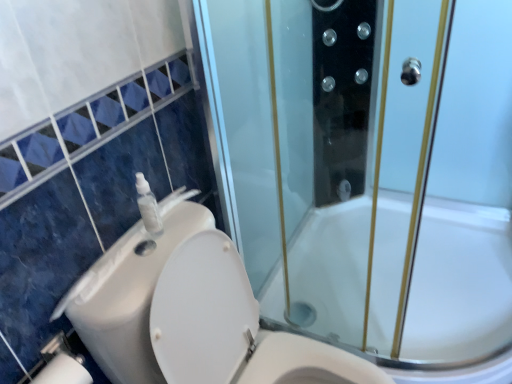
The height and width of the screenshot is (384, 512). Find the location of `transparent glass shower door at center`. transparent glass shower door at center is located at coordinates (371, 173).

In order to face transparent glass shower door at center, should I rotate leftwards or rightwards?

You should look right and rotate roughly 19.530 degrees.

What is the approximate height of white plastic toilet at lower left?

It is 33.15 inches.

This screenshot has width=512, height=384. I want to click on transparent plastic soap dispenser at upper left, so 148,206.

In order to click on transparent glass shower door at center in this screenshot , I will do `click(371, 173)`.

Consider the image. Can you confirm if transparent plastic soap dispenser at upper left is thinner than transparent glass shower door at center?

Yes, transparent plastic soap dispenser at upper left is thinner than transparent glass shower door at center.

From the image's perspective, is transparent plastic soap dispenser at upper left above transparent glass shower door at center?

No, from the image's perspective, transparent plastic soap dispenser at upper left is not above transparent glass shower door at center.

From a real-world perspective, is transparent plastic soap dispenser at upper left physically located above or below transparent glass shower door at center?

Clearly, from a real-world perspective, transparent plastic soap dispenser at upper left is above transparent glass shower door at center.

How different are the orientations of transparent plastic soap dispenser at upper left and transparent glass shower door at center in degrees?

The angle between the facing direction of transparent plastic soap dispenser at upper left and the facing direction of transparent glass shower door at center is 91.1 degrees.

Based on their sizes in the image, would you say transparent plastic soap dispenser at upper left is bigger or smaller than white plastic toilet at lower left?

Clearly, transparent plastic soap dispenser at upper left is smaller in size than white plastic toilet at lower left.

How different are the orientations of transparent plastic soap dispenser at upper left and white plastic toilet at lower left in degrees?

The angular difference between transparent plastic soap dispenser at upper left and white plastic toilet at lower left is 0.000347 degrees.

From their relative heights in the image, would you say transparent plastic soap dispenser at upper left is taller or shorter than white plastic toilet at lower left?

transparent plastic soap dispenser at upper left is shorter than white plastic toilet at lower left.

Is transparent plastic soap dispenser at upper left turned away from white plastic toilet at lower left?

No, transparent plastic soap dispenser at upper left is not facing away from white plastic toilet at lower left.

From the picture: Is white plastic toilet at lower left closer to camera compared to transparent glass shower door at center?

Yes, it is.

From a real-world perspective, is white plastic toilet at lower left physically located above or below transparent glass shower door at center?

white plastic toilet at lower left is situated lower than transparent glass shower door at center in the real world.

In the image, is white plastic toilet at lower left on the left side or the right side of transparent glass shower door at center?

From the image, it's evident that white plastic toilet at lower left is to the left of transparent glass shower door at center.

Is white plastic toilet at lower left shorter than transparent glass shower door at center?

Correct, white plastic toilet at lower left is not as tall as transparent glass shower door at center.

In order to click on screen door above the white plastic sink at left (from the image's perspective) in this screenshot , I will do [371, 173].

Does transparent glass shower door at center have a smaller size compared to white plastic sink at left?

No, transparent glass shower door at center is not smaller than white plastic sink at left.

Would you consider transparent glass shower door at center to be distant from white plastic sink at left?

No, there isn't a large distance between transparent glass shower door at center and white plastic sink at left.

Visually, is transparent glass shower door at center positioned to the left or to the right of white plastic sink at left?

transparent glass shower door at center is to the right of white plastic sink at left.

Is white plastic sink at left taller or shorter than transparent plastic soap dispenser at upper left?

white plastic sink at left is shorter than transparent plastic soap dispenser at upper left.

Does white plastic sink at left have a larger size compared to transparent plastic soap dispenser at upper left?

Indeed, white plastic sink at left has a larger size compared to transparent plastic soap dispenser at upper left.

Is white plastic sink at left far away from transparent plastic soap dispenser at upper left?

That's not correct — white plastic sink at left is a little close to transparent plastic soap dispenser at upper left.

From a real-world perspective, which object stands above the other?

In real-world perspective, white plastic sink at left is above.

Is white plastic sink at left beside white plastic toilet at lower left?

Indeed, white plastic sink at left and white plastic toilet at lower left are beside each other and touching.

At what (x,y) coordinates should I click in order to perform the action: click on sink that is above the white plastic toilet at lower left (from a real-world perspective). Please return your answer as a coordinate pair (x, y). Looking at the image, I should click on (128, 296).

Between point (112, 290) and point (222, 359), which one is positioned in front?

Positioned in front is point (112, 290).

Considering their positions, is transparent glass shower door at center located in front of or behind transparent plastic soap dispenser at upper left?

transparent glass shower door at center is positioned closer to the viewer than transparent plastic soap dispenser at upper left.

From a real-world perspective, which is physically below, transparent glass shower door at center or transparent plastic soap dispenser at upper left?

From a 3D spatial view, transparent glass shower door at center is below.

Which of these two, transparent glass shower door at center or transparent plastic soap dispenser at upper left, is thinner?

With smaller width is transparent plastic soap dispenser at upper left.

Which of these two, transparent glass shower door at center or transparent plastic soap dispenser at upper left, is smaller?

Smaller between the two is transparent plastic soap dispenser at upper left.

The image size is (512, 384). I want to click on screen door in front of the transparent plastic soap dispenser at upper left, so click(371, 173).

Identify the location of soap dispenser above the white plastic toilet at lower left (from a real-world perspective). (148, 206).

Which object lies further to the anchor point transparent plastic soap dispenser at upper left, white plastic toilet at lower left or white plastic sink at left?

white plastic toilet at lower left is positioned further to the anchor transparent plastic soap dispenser at upper left.

Based on their spatial positions, is transparent plastic soap dispenser at upper left or transparent glass shower door at center closer to white plastic toilet at lower left?

Among the two, transparent plastic soap dispenser at upper left is located nearer to white plastic toilet at lower left.

Which object lies nearer to the anchor point white plastic sink at left, transparent glass shower door at center or transparent plastic soap dispenser at upper left?

Based on the image, transparent plastic soap dispenser at upper left appears to be nearer to white plastic sink at left.

Based on their spatial positions, is white plastic toilet at lower left or transparent plastic soap dispenser at upper left closer to white plastic sink at left?

white plastic toilet at lower left lies closer to white plastic sink at left than the other object.

Estimate the real-world distances between objects in this image. Which object is closer to transparent plastic soap dispenser at upper left, transparent glass shower door at center or white plastic sink at left?

white plastic sink at left is positioned closer to the anchor transparent plastic soap dispenser at upper left.

Based on their spatial positions, is transparent glass shower door at center or white plastic sink at left closer to white plastic toilet at lower left?

white plastic sink at left is positioned closer to the anchor white plastic toilet at lower left.

Which object lies further to the anchor point white plastic toilet at lower left, transparent plastic soap dispenser at upper left or white plastic sink at left?

Among the two, transparent plastic soap dispenser at upper left is located further to white plastic toilet at lower left.

From the image, which object appears to be farther from transparent plastic soap dispenser at upper left, transparent glass shower door at center or white plastic toilet at lower left?

transparent glass shower door at center lies further to transparent plastic soap dispenser at upper left than the other object.

The width and height of the screenshot is (512, 384). What are the coordinates of `toilet between white plastic sink at left and transparent glass shower door at center in the horizontal direction` in the screenshot? It's located at (191, 314).

The height and width of the screenshot is (384, 512). What are the coordinates of `toilet located between transparent plastic soap dispenser at upper left and transparent glass shower door at center in the left-right direction` in the screenshot? It's located at (191, 314).

Locate an element on the screen. sink between transparent plastic soap dispenser at upper left and white plastic toilet at lower left in the up-down direction is located at coordinates (128, 296).

This screenshot has height=384, width=512. What are the coordinates of `soap dispenser between white plastic sink at left and transparent glass shower door at center from left to right` in the screenshot? It's located at (148, 206).